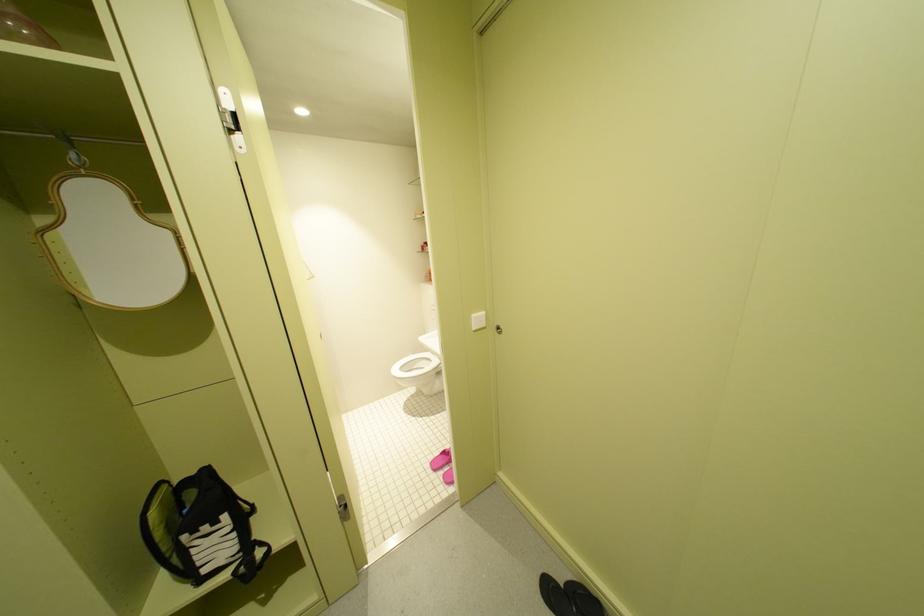
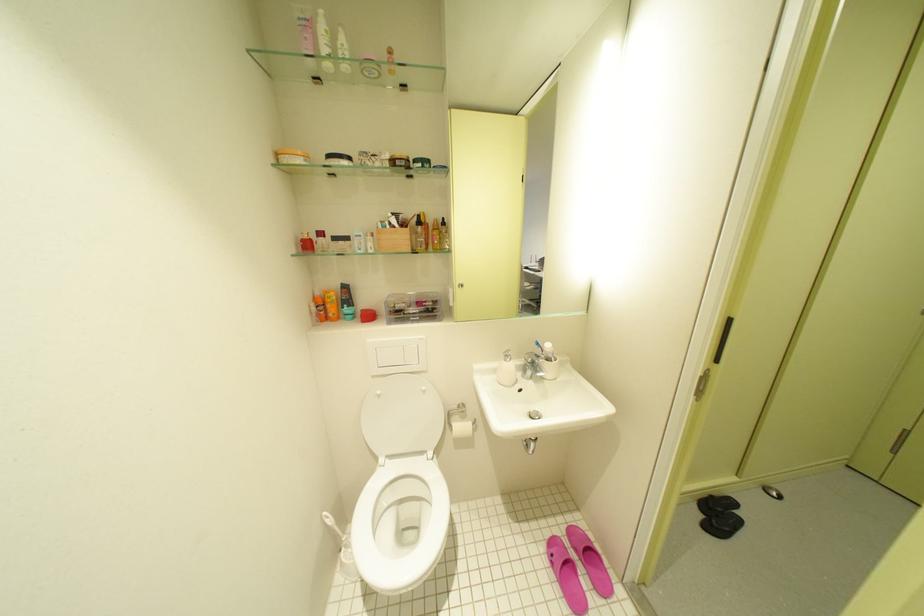
In the second image, find the point that corresponds to pixel 445 467 in the first image.

(587, 604)